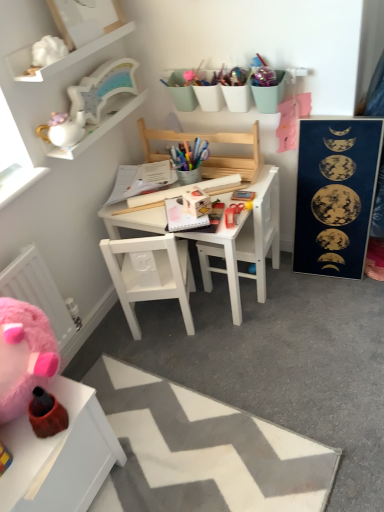
Locate an element on the screen. Image resolution: width=384 pixels, height=512 pixels. space that is in front of white matte chair at center, acting as the 2th chair starting from the top is located at coordinates (180, 356).